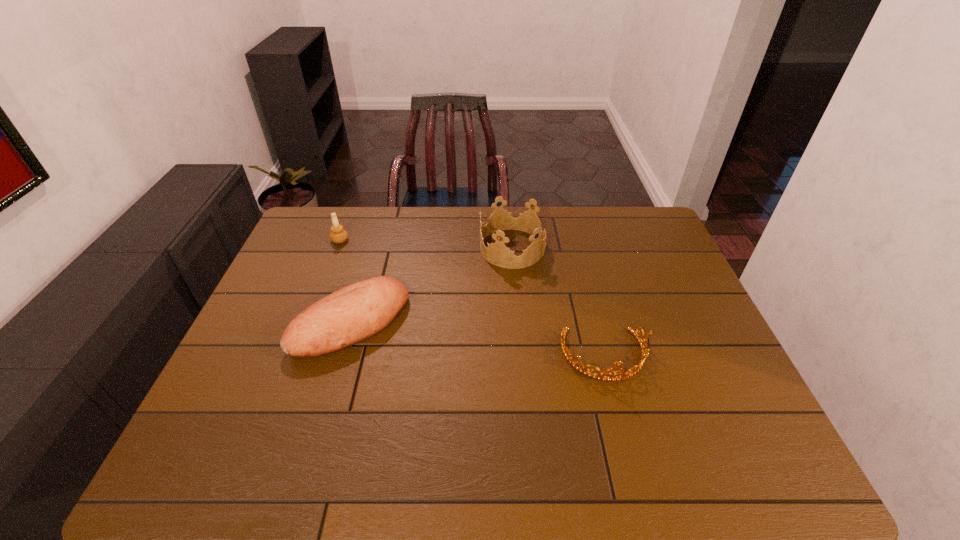
This screenshot has width=960, height=540. Identify the location of empty space between the tallest object and the nearer tiara. (559, 302).

Find the location of a particular element. The height and width of the screenshot is (540, 960). free space between the nearer tiara and the candle_holder is located at coordinates (472, 298).

Identify which object is located as the second nearest to the taller tiara. Please provide its 2D coordinates. Your answer should be formatted as a tuple, i.e. [(x, y)], where the tuple contains the x and y coordinates of a point satisfying the conditions above.

[(633, 370)]

Select which object is the second closest to the tallest object. Please provide its 2D coordinates. Your answer should be formatted as a tuple, i.e. [(x, y)], where the tuple contains the x and y coordinates of a point satisfying the conditions above.

[(633, 370)]